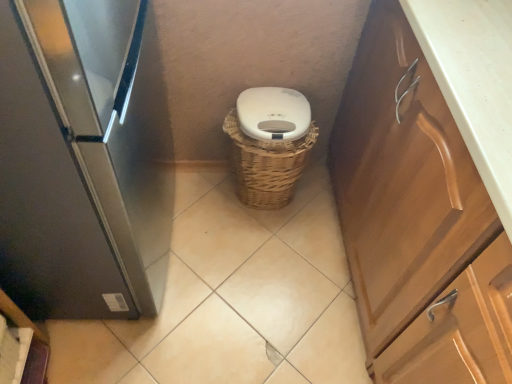
Question: From a real-world perspective, is satin black refrigerator at left above or below woven brown basket at center?

Choices:
 (A) above
 (B) below

Answer: (A)

Question: Is satin black refrigerator at left inside or outside of woven brown basket at center?

Choices:
 (A) outside
 (B) inside

Answer: (A)

Question: Estimate the real-world distances between objects in this image. Which object is closer to the white matte toilet bowl at center?

Choices:
 (A) satin black refrigerator at left
 (B) woven brown basket at center
 (C) wooden cabinet at right
 (D) woven brown basket at center

Answer: (D)

Question: Which of these objects is positioned closest to the woven brown basket at center?

Choices:
 (A) woven brown basket at center
 (B) wooden cabinet at right
 (C) satin black refrigerator at left
 (D) white matte toilet bowl at center

Answer: (A)